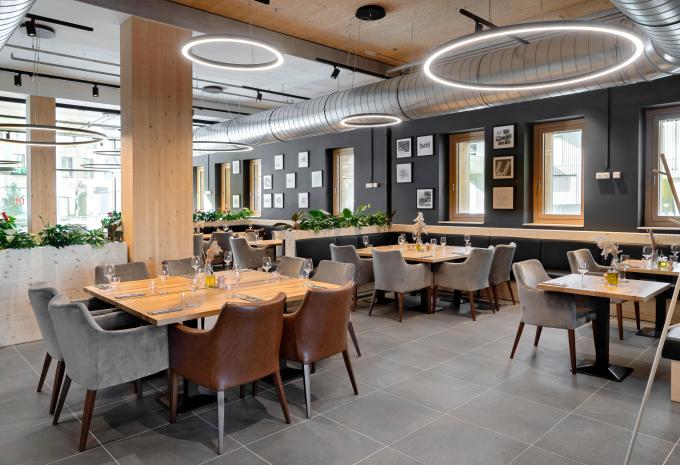
Find the location of `ceiling light`. ceiling light is located at coordinates (39, 126), (9, 159), (105, 164), (109, 150), (233, 142), (233, 39), (362, 115), (469, 37).